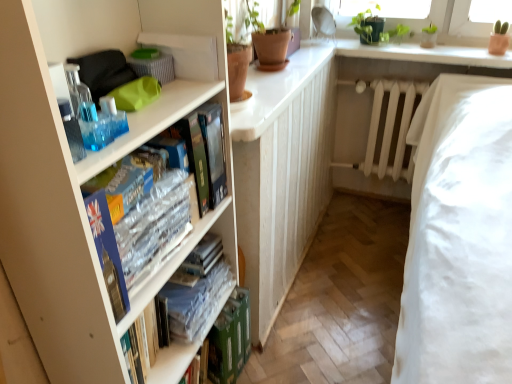
Question: Based on their positions, is white matte radiator at center located to the left or right of clear plastic book at center, placed as the 2th book when sorted from bottom to top?

Choices:
 (A) right
 (B) left

Answer: (A)

Question: Is white matte radiator at center spatially inside clear plastic book at center, which is counted as the second book, starting from the back, or outside of it?

Choices:
 (A) inside
 (B) outside

Answer: (B)

Question: Which object is the farthest from the clear plastic books at center left, marked as the 3th book in a back-to-front arrangement?

Choices:
 (A) white matte radiator at center
 (B) green matte plant at upper right
 (C) white glossy counter top at upper center
 (D) translucent plastic bottles at left
 (E) white smooth window sill at upper center

Answer: (A)

Question: Considering the real-world distances, which object is closest to the white matte bookcase at left?

Choices:
 (A) clear plastic book at center, which is counted as the second book, starting from the back
 (B) clear plastic books at center left, which is the 1th book from top to bottom
 (C) translucent plastic bottles at left
 (D) white smooth window sill at upper center
 (E) white matte radiator at center

Answer: (B)